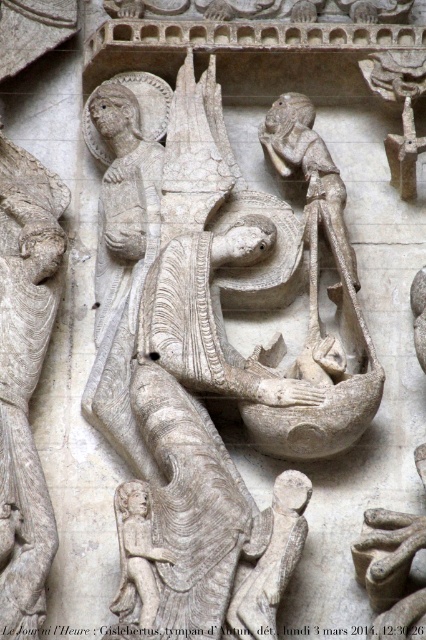
Is point (336, 248) positioned behind point (14, 369)?

That is True.

Can you confirm if stone statue at center is shorter than white stone angel at upper left?

In fact, stone statue at center may be taller than white stone angel at upper left.

Which is in front, point (241, 365) or point (25, 172)?

Point (241, 365) is more forward.

Where is `stone statue at center`? Image resolution: width=426 pixels, height=640 pixels. stone statue at center is located at coordinates (210, 364).